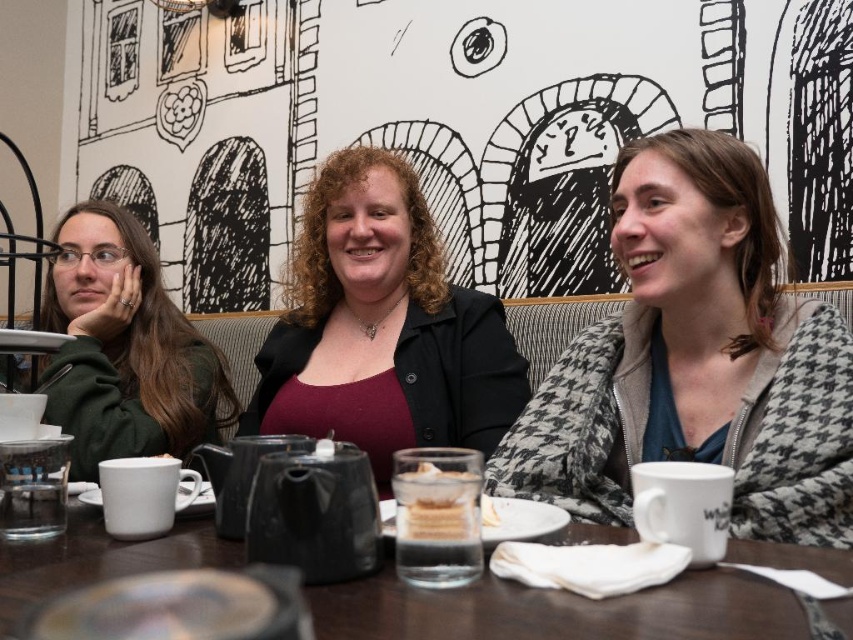
Question: Can you confirm if matte black blazer at center is positioned to the left of white ceramic mug at lower right?

Choices:
 (A) no
 (B) yes

Answer: (B)

Question: Estimate the real-world distances between objects in this image. Which object is closer to the white ceramic mug at upper right?

Choices:
 (A) green matte jacket at left
 (B) white ceramic mug at lower right
 (C) matte black blazer at center

Answer: (B)

Question: From the image, what is the correct spatial relationship of white ceramic mug at upper right in relation to white ceramic mug at lower right?

Choices:
 (A) above
 (B) below

Answer: (A)

Question: In this image, where is matte black blazer at center located relative to white ceramic mug at lower right?

Choices:
 (A) below
 (B) above

Answer: (B)

Question: Which object appears closest to the camera in this image?

Choices:
 (A) matte white mug at center
 (B) matte black blazer at center
 (C) white ceramic mug at lower right

Answer: (A)

Question: Which point is closer to the camera?

Choices:
 (A) (326, 353)
 (B) (109, 336)

Answer: (A)